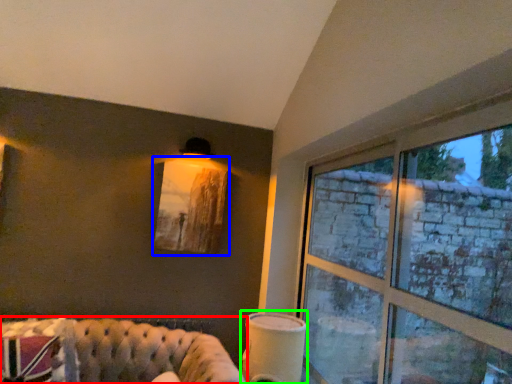
Question: Based on their relative distances, which object is nearer to studio couch (highlighted by a red box)? Choose from picture frame (highlighted by a blue box) and table lamp (highlighted by a green box).

Choices:
 (A) picture frame
 (B) table lamp

Answer: (B)